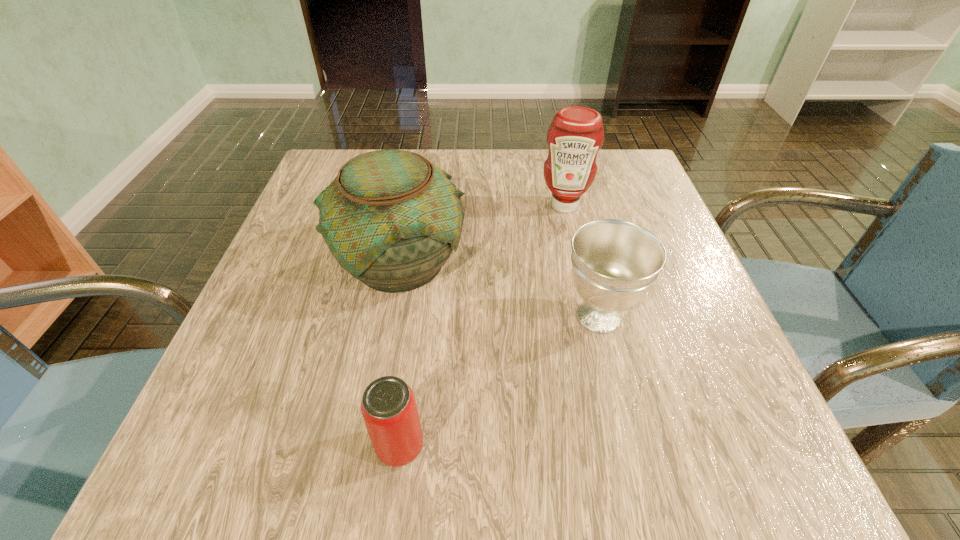
You are a GUI agent. You are given a task and a screenshot of the screen. Output one action in this format:
    pyautogui.click(x=<x>, y=<y>)
    Task: Click on the object present at the near edge
    Image resolution: width=960 pixels, height=540 pixels.
    Given the screenshot: What is the action you would take?
    pyautogui.click(x=388, y=406)

Locate an element on the screen. Image resolution: width=960 pixels, height=540 pixels. object present at the left edge is located at coordinates (391, 219).

This screenshot has height=540, width=960. Find the location of `condiment that is at the right edge`. condiment that is at the right edge is located at coordinates (576, 134).

Where is `chalice present at the right edge`? The image size is (960, 540). chalice present at the right edge is located at coordinates (614, 262).

The height and width of the screenshot is (540, 960). I want to click on object present at the far right corner, so click(x=576, y=134).

Locate an element on the screen. The width and height of the screenshot is (960, 540). vacant space at the far edge is located at coordinates (511, 166).

Find the location of `free region at the near edge of the desktop`. free region at the near edge of the desktop is located at coordinates (365, 473).

This screenshot has width=960, height=540. I want to click on vacant space at the left edge of the desktop, so click(x=331, y=265).

In order to click on vacant space at the right edge in this screenshot , I will do `click(706, 389)`.

Where is `vacant space at the far left corner of the desktop`? This screenshot has height=540, width=960. vacant space at the far left corner of the desktop is located at coordinates (328, 180).